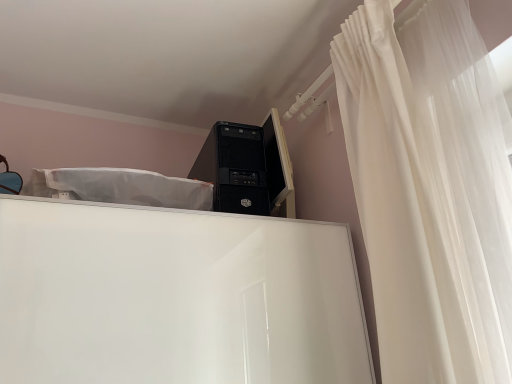
This screenshot has height=384, width=512. I want to click on black matte desktop computer at upper center, so click(x=247, y=168).

Identify the location of white sheer curtain at upper right. The height and width of the screenshot is (384, 512). (x=411, y=217).

The height and width of the screenshot is (384, 512). What do you see at coordinates (411, 217) in the screenshot?
I see `white sheer curtain at upper right` at bounding box center [411, 217].

In order to click on matte black monitor at upper right in this screenshot , I will do `click(278, 167)`.

At what (x,y) coordinates should I click in order to perform the action: click on black matte desktop computer at upper center. Please return your answer as a coordinate pair (x, y). Looking at the image, I should click on (247, 168).

Considering the sizes of objects white sheer curtain at upper right and matte black monitor at upper right in the image provided, who is wider, white sheer curtain at upper right or matte black monitor at upper right?

With larger width is white sheer curtain at upper right.

Which point is more forward, (373, 42) or (289, 193)?

The point (373, 42) is closer.

Is matte black monitor at upper right located within white sheer curtain at upper right?

No, matte black monitor at upper right is located outside of white sheer curtain at upper right.

Based on their positions, is white sheer curtain at upper right located to the left or right of matte black monitor at upper right?

From the image, it's evident that white sheer curtain at upper right is to the right of matte black monitor at upper right.

Considering the points (288, 203) and (262, 182), which point is in front, point (288, 203) or point (262, 182)?

The point (262, 182) is more forward.

Is matte black monitor at upper right bigger or smaller than black matte desktop computer at upper center?

Considering their sizes, matte black monitor at upper right takes up less space than black matte desktop computer at upper center.

In the image, there is a matte black monitor at upper right. At what (x,y) coordinates should I click in order to perform the action: click on desktop computer below it (from a real-world perspective). Please return your answer as a coordinate pair (x, y). Looking at the image, I should click on (247, 168).

Could you tell me if black matte desktop computer at upper center is facing matte black monitor at upper right?

No, black matte desktop computer at upper center is not oriented towards matte black monitor at upper right.

Which is more to the left, black matte desktop computer at upper center or matte black monitor at upper right?

black matte desktop computer at upper center is more to the left.

Does black matte desktop computer at upper center have a greater width compared to matte black monitor at upper right?

Yes.

Is black matte desktop computer at upper center positioned before matte black monitor at upper right?

That is True.

Is black matte desktop computer at upper center a part of white sheer curtain at upper right?

No, white sheer curtain at upper right does not contain black matte desktop computer at upper center.

Does white sheer curtain at upper right lie in front of black matte desktop computer at upper center?

Yes, it is in front of black matte desktop computer at upper center.

Based on their positions, is white sheer curtain at upper right located to the left or right of black matte desktop computer at upper center?

white sheer curtain at upper right is positioned on black matte desktop computer at upper center's right side.

From a real-world perspective, is white sheer curtain at upper right positioned under black matte desktop computer at upper center based on gravity?

Yes, from a real-world perspective, white sheer curtain at upper right is under black matte desktop computer at upper center.

In terms of size, does matte black monitor at upper right appear bigger or smaller than white sheer curtain at upper right?

Considering their sizes, matte black monitor at upper right takes up less space than white sheer curtain at upper right.

Considering the sizes of objects matte black monitor at upper right and white sheer curtain at upper right in the image provided, who is thinner, matte black monitor at upper right or white sheer curtain at upper right?

With smaller width is matte black monitor at upper right.

Does matte black monitor at upper right appear on the left side of white sheer curtain at upper right?

Yes.

From the picture: From the image's perspective, is matte black monitor at upper right positioned above or below white sheer curtain at upper right?

Clearly, from the image's perspective, matte black monitor at upper right is above white sheer curtain at upper right.

Considering the sizes of objects black matte desktop computer at upper center and white sheer curtain at upper right in the image provided, who is bigger, black matte desktop computer at upper center or white sheer curtain at upper right?

With larger size is white sheer curtain at upper right.

In terms of height, does black matte desktop computer at upper center look taller or shorter compared to white sheer curtain at upper right?

Considering their sizes, black matte desktop computer at upper center has less height than white sheer curtain at upper right.

In the image, there is a white sheer curtain at upper right. Identify the location of desktop computer below it (from the image's perspective). (247, 168).

Would you say black matte desktop computer at upper center is outside white sheer curtain at upper right?

That's correct, black matte desktop computer at upper center is outside of white sheer curtain at upper right.

Where is `curtain directly beneath the matte black monitor at upper right (from a real-world perspective)`? This screenshot has width=512, height=384. curtain directly beneath the matte black monitor at upper right (from a real-world perspective) is located at coordinates (411, 217).

Where is `computer monitor to the right of black matte desktop computer at upper center`? The image size is (512, 384). computer monitor to the right of black matte desktop computer at upper center is located at coordinates (278, 167).

Consider the image. From the image, which object appears to be farther from white sheer curtain at upper right, matte black monitor at upper right or black matte desktop computer at upper center?

Based on the image, matte black monitor at upper right appears to be further to white sheer curtain at upper right.

Looking at the image, which one is located further to black matte desktop computer at upper center, white sheer curtain at upper right or matte black monitor at upper right?

The object further to black matte desktop computer at upper center is white sheer curtain at upper right.

Based on their spatial positions, is white sheer curtain at upper right or black matte desktop computer at upper center further from matte black monitor at upper right?

white sheer curtain at upper right lies further to matte black monitor at upper right than the other object.

Which object lies nearer to the anchor point matte black monitor at upper right, black matte desktop computer at upper center or white sheer curtain at upper right?

black matte desktop computer at upper center.

When comparing their distances from black matte desktop computer at upper center, does matte black monitor at upper right or white sheer curtain at upper right seem further?

Based on the image, white sheer curtain at upper right appears to be further to black matte desktop computer at upper center.

Looking at the image, which one is located closer to white sheer curtain at upper right, black matte desktop computer at upper center or matte black monitor at upper right?

black matte desktop computer at upper center.

In order to click on desktop computer between white sheer curtain at upper right and matte black monitor at upper right in the front-back direction in this screenshot , I will do `click(247, 168)`.